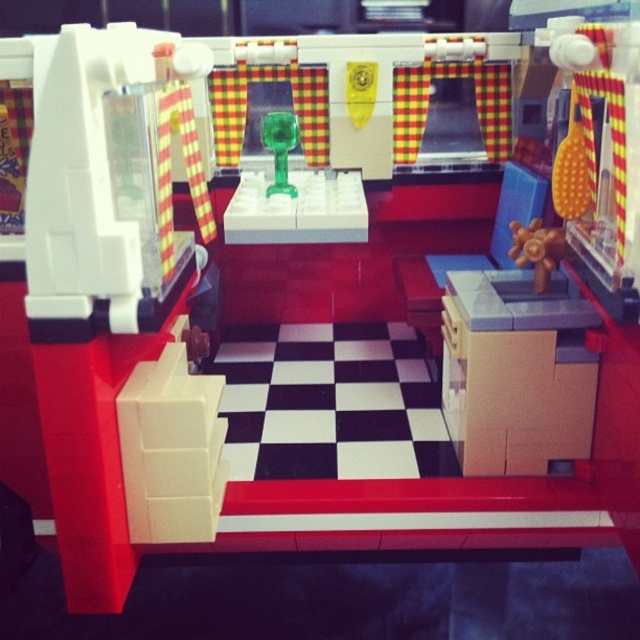
You are a small toy car that is 10 inches long. You want to drive from the wooden fan at center right to the green translucent plastic cup at center. Can you make the trip without hitting anything?

The distance between the wooden fan at center right and the green translucent plastic cup at center is 25.43 inches. Since the toy car is only 10 inches long, there is enough space for it to travel between them without any obstructions. Therefore, the toy car can safely make the trip.

You are a child in the Lego kitchen scene. You want to reach the green translucent plastic cup at center to drink water. Can you easily reach it without moving the wooden fan at center right?

The wooden fan at center right is located below the green translucent plastic cup at center, so the cup is above the fan. Since the cup is above, you can easily reach it without needing to move the wooden fan at center right.